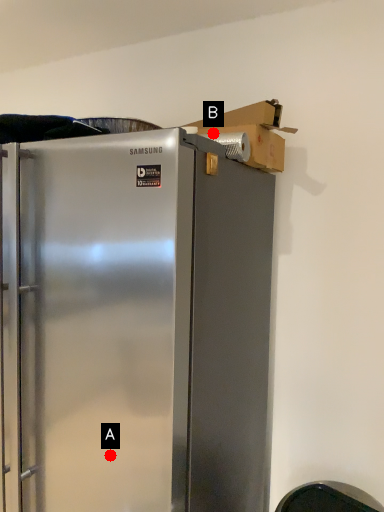
Question: Two points are circled on the image, labeled by A and B beside each circle. Among these points, which one is farthest from the camera?

Choices:
 (A) A is further
 (B) B is further

Answer: (B)